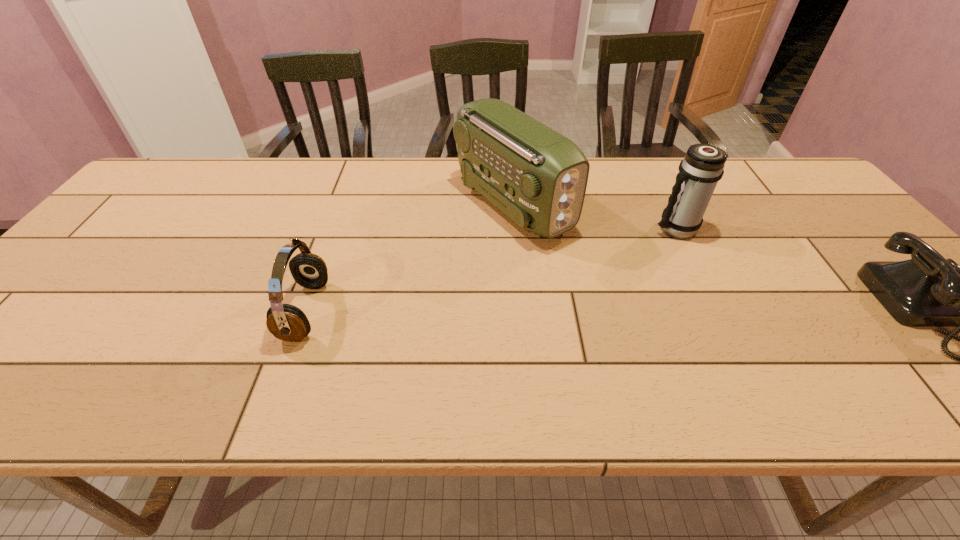
This screenshot has height=540, width=960. I want to click on the second shortest object, so click(286, 322).

Find the location of `the leftmost object`. the leftmost object is located at coordinates (286, 322).

You are a GUI agent. You are given a task and a screenshot of the screen. Output one action in this format:
    pyautogui.click(x=<x>, y=<y>)
    Task: Click on the third object from right to left
    Image resolution: width=960 pixels, height=540 pixels.
    Given the screenshot: What is the action you would take?
    pyautogui.click(x=536, y=176)

Where is `the second object from right to left`? the second object from right to left is located at coordinates (703, 165).

Find the location of a particular element. free space located on the ear cups of the second shortest object is located at coordinates click(233, 311).

Locate an element on the screen. The height and width of the screenshot is (540, 960). vacant space situated 0.250m on the ear cups of the second shortest object is located at coordinates (176, 311).

Where is `free space located on the ear cups of the second shortest object`? The height and width of the screenshot is (540, 960). free space located on the ear cups of the second shortest object is located at coordinates (211, 311).

Locate an element on the screen. The image size is (960, 540). free region located 0.080m on the front-facing side of the radio_receiver is located at coordinates (573, 259).

The image size is (960, 540). In order to click on vacant space located on the front-facing side of the radio_receiver in this screenshot , I will do `click(589, 272)`.

At what (x,y) coordinates should I click in order to perform the action: click on vacant space positioned on the front-facing side of the radio_receiver. Please return your answer as a coordinate pair (x, y). This screenshot has width=960, height=540. Looking at the image, I should click on click(592, 275).